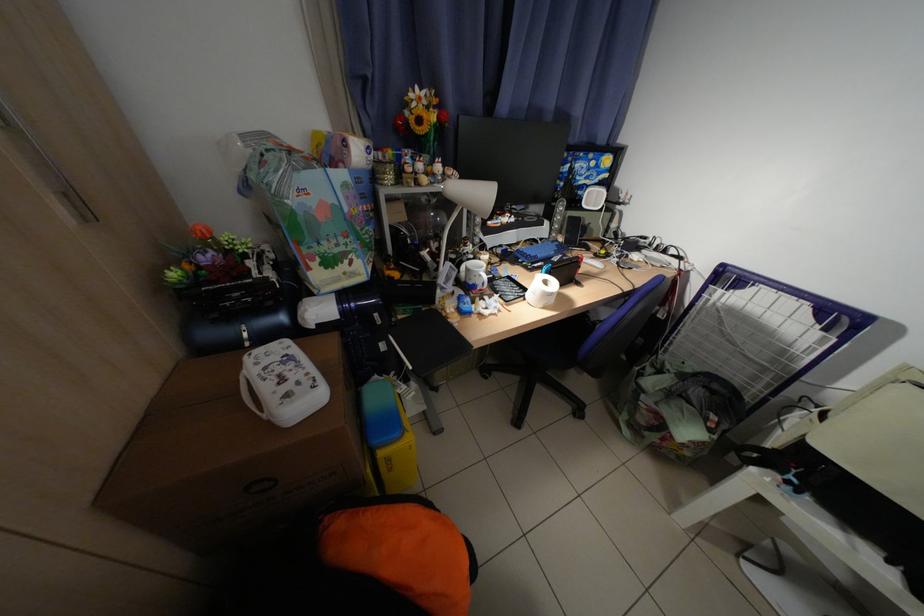
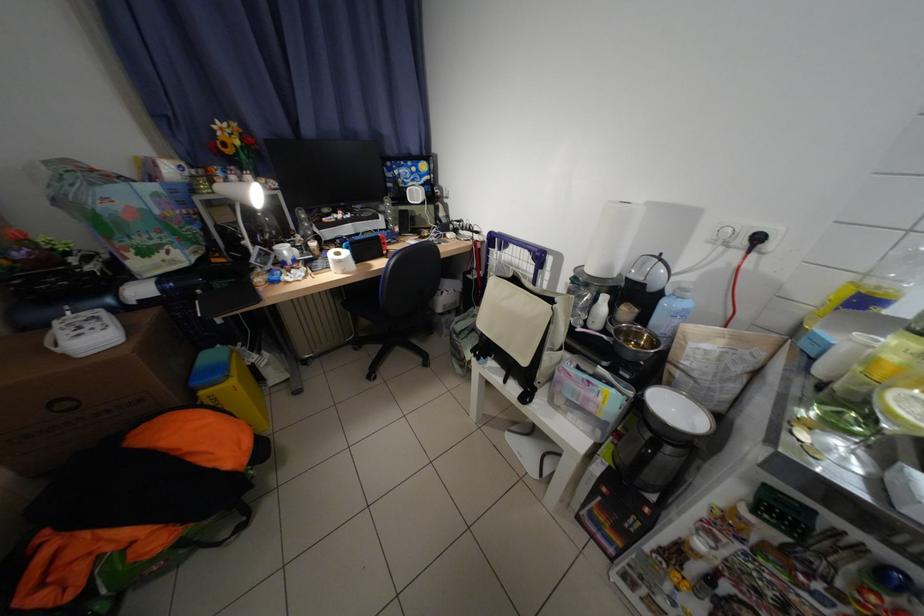
Based on the photo, in a continuous first-person perspective shot, in which direction is the camera moving?

The cameraman moved toward right, backward.